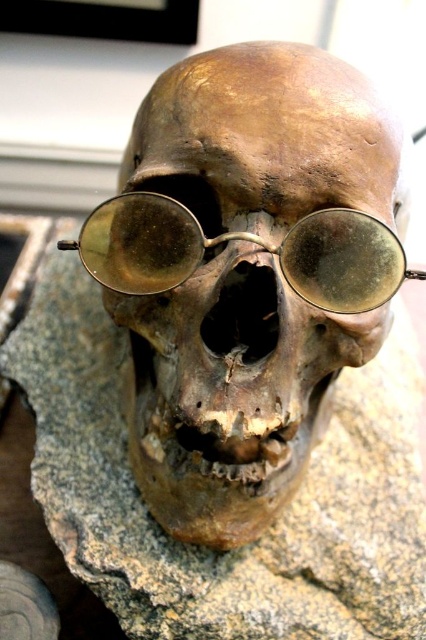
Between brown rough stone at center and gold reflective glasses at center, which one is positioned lower?

brown rough stone at center

Is point (95, 529) closer to camera compared to point (150, 221)?

No, it is not.

Which is in front, point (112, 541) or point (377, 241)?

Point (377, 241) is more forward.

The width and height of the screenshot is (426, 640). What are the coordinates of `brown rough stone at center` in the screenshot? It's located at (270, 525).

This screenshot has width=426, height=640. Describe the element at coordinates (230, 392) in the screenshot. I see `brown matte skull at center` at that location.

What do you see at coordinates (230, 392) in the screenshot?
I see `brown matte skull at center` at bounding box center [230, 392].

At what (x,y) coordinates should I click in order to perform the action: click on brown matte skull at center. Please return your answer as a coordinate pair (x, y). The height and width of the screenshot is (640, 426). Looking at the image, I should click on (230, 392).

Can you confirm if brown matte skull at center is positioned to the left of brown rough stone at center?

Incorrect, brown matte skull at center is not on the left side of brown rough stone at center.

Is brown matte skull at center closer to the viewer compared to brown rough stone at center?

Yes, brown matte skull at center is closer to the viewer.

Is point (230, 173) positioned after point (396, 604)?

No.

I want to click on brown matte skull at center, so click(230, 392).